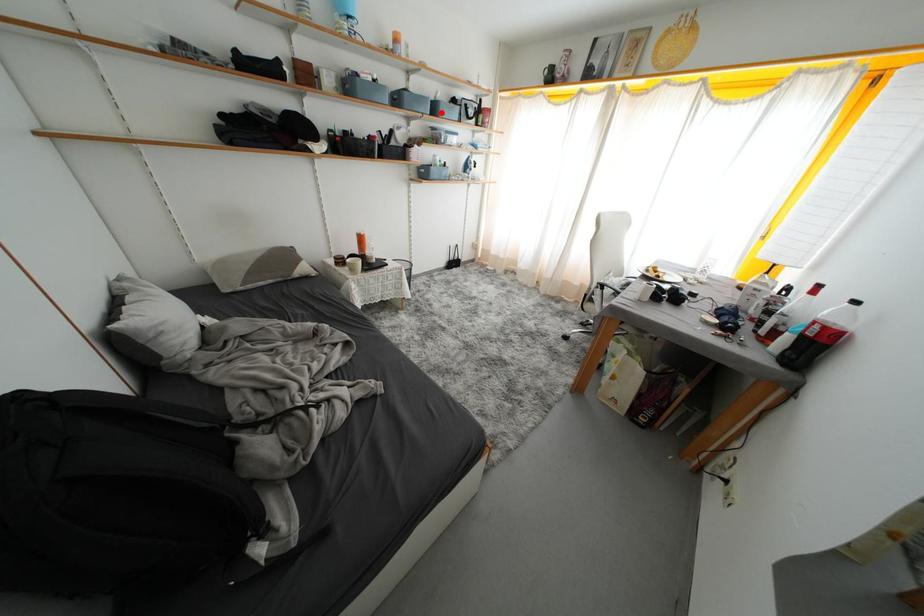
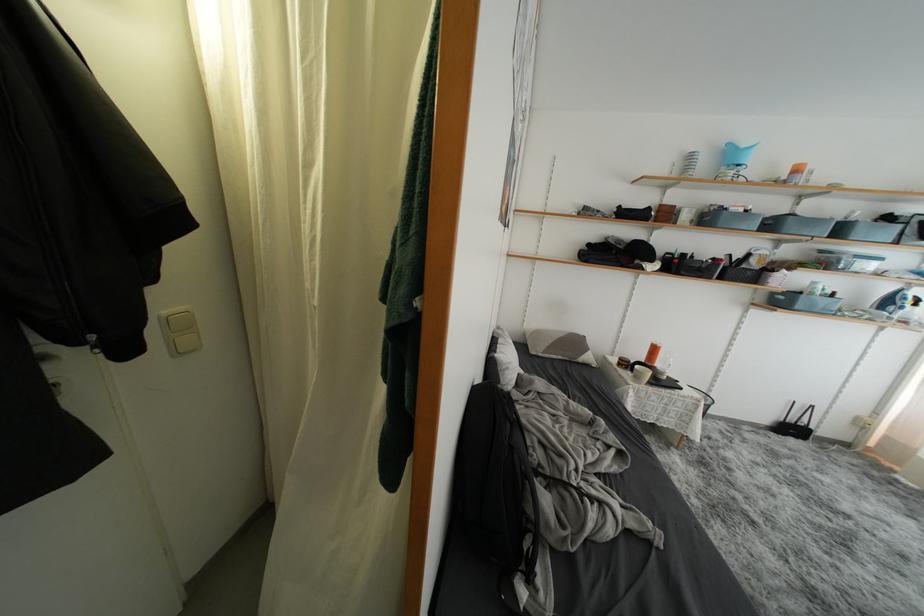
The point at the highlighted location is marked in the first image. Where is the corresponding point in the second image?

(847, 235)